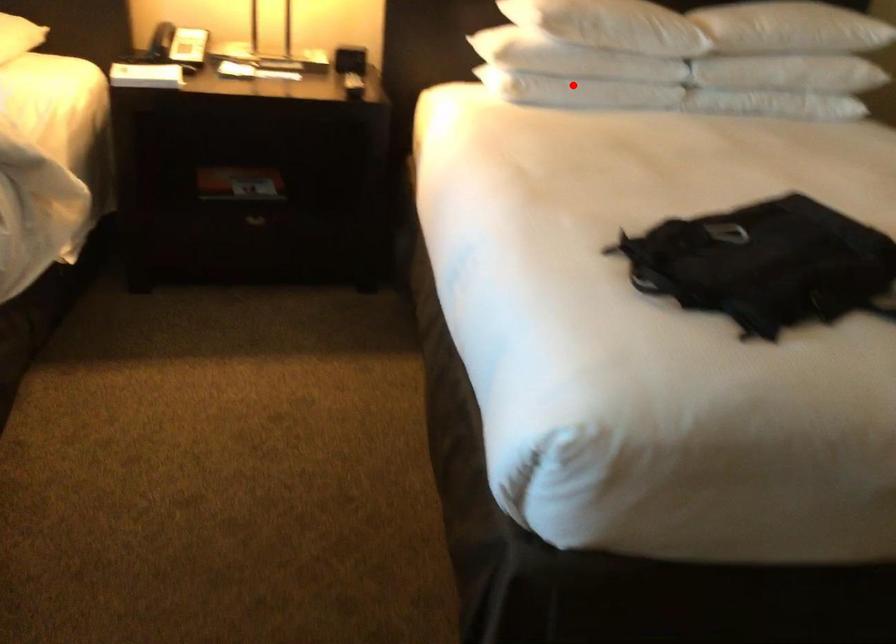
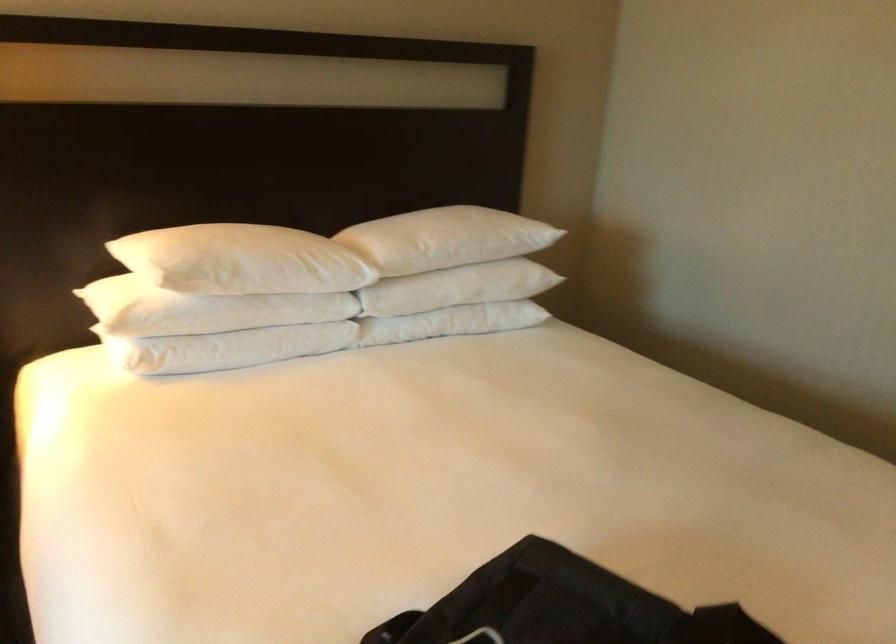
Question: A red point is marked in image1. In image2, is the corresponding 3D point closer to the camera or farther? Reply with the corresponding letter.

Choices:
 (A) The corresponding 3D point is closer.
 (B) The corresponding 3D point is farther.

Answer: (A)